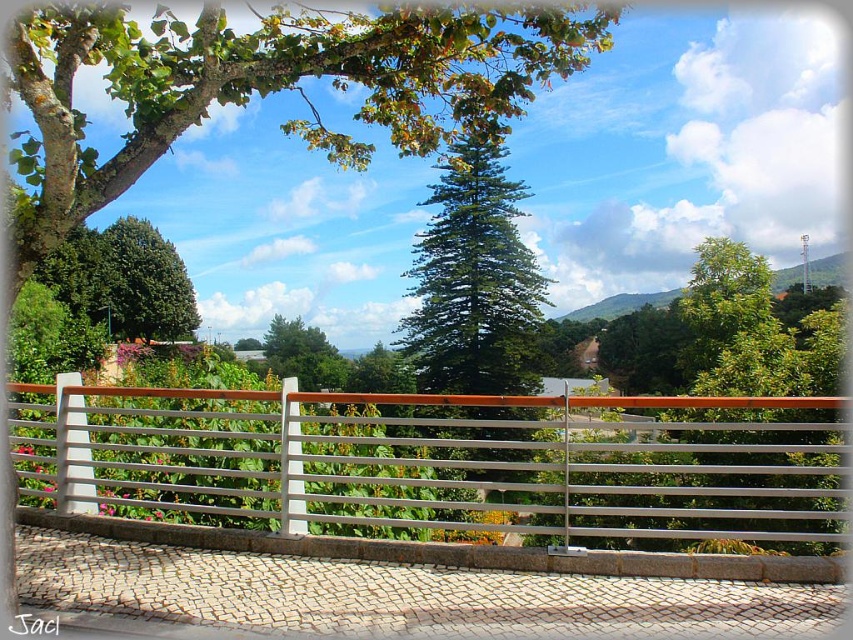
You are a hiker standing on the walkway and want to take a photo of both the green textured pine tree at center and the green leafy tree at center. Which tree should you move closer to in order to capture both in the same frame?

The green textured pine tree at center is positioned under the green leafy tree at center, so moving closer to the green leafy tree at center would allow both trees to be in the same frame.

You are standing at the center of the paved walkway and want to locate the silver metallic fence at center. According to the image, where would you find it in relation to your current position?

The silver metallic fence at center is located at the coordinates point [444,461], which is to the right and slightly forward from your current position at the center of the paved walkway.

You are standing in the scenic outdoor area and want to take a photo of the green leafy tree at upper center. Where should you position yourself to capture it in the frame?

To capture the green leafy tree at upper center in your photo, position yourself so that the tree is centered at coordinates approximately 0.138 on the horizontal axis and 0.313 on the vertical axis within the frame.